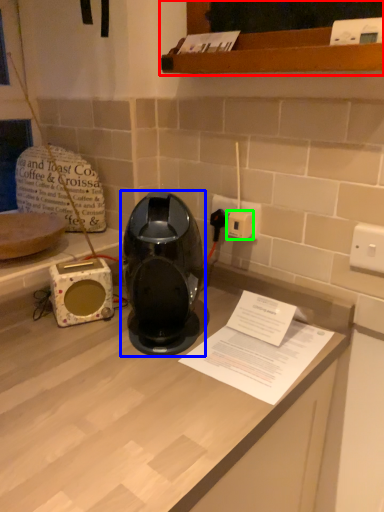
Question: Estimate the real-world distances between objects in this image. Which object is closer to cabinetry (highlighted by a red box), home appliance (highlighted by a blue box) or socket (highlighted by a green box)?

Choices:
 (A) home appliance
 (B) socket

Answer: (B)